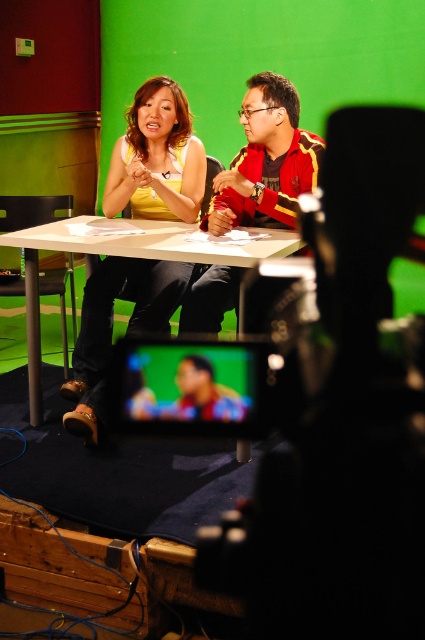
You are a camera operator adjusting the camera focus. The camera is currently focused on the green screen in the background. To focus on the yellow fabric top at center, should you adjust the focus closer or farther away?

Since the yellow fabric top at center is positioned at point (156,157), which is in the foreground compared to the green screen in the background, you should adjust the focus closer to capture the yellow fabric top at center properly.